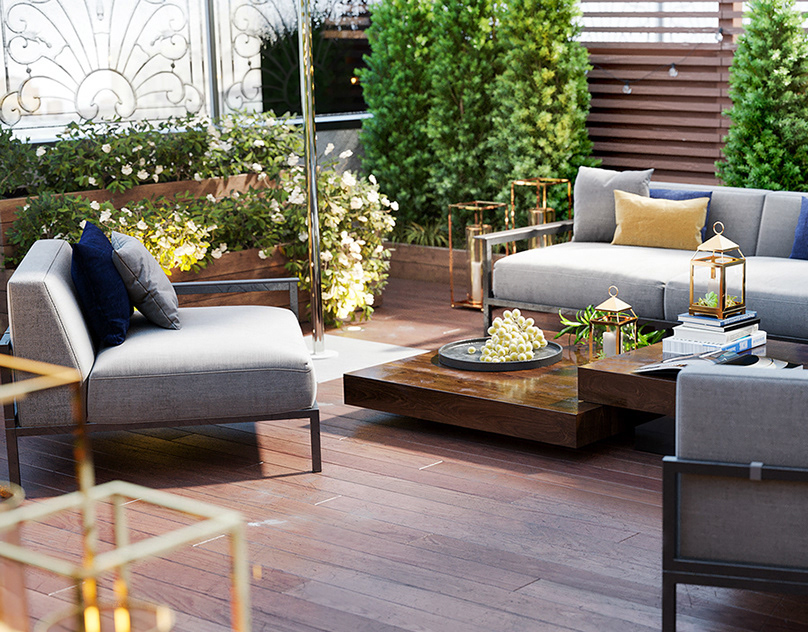
The width and height of the screenshot is (808, 632). I want to click on sofa, so click(x=792, y=272).